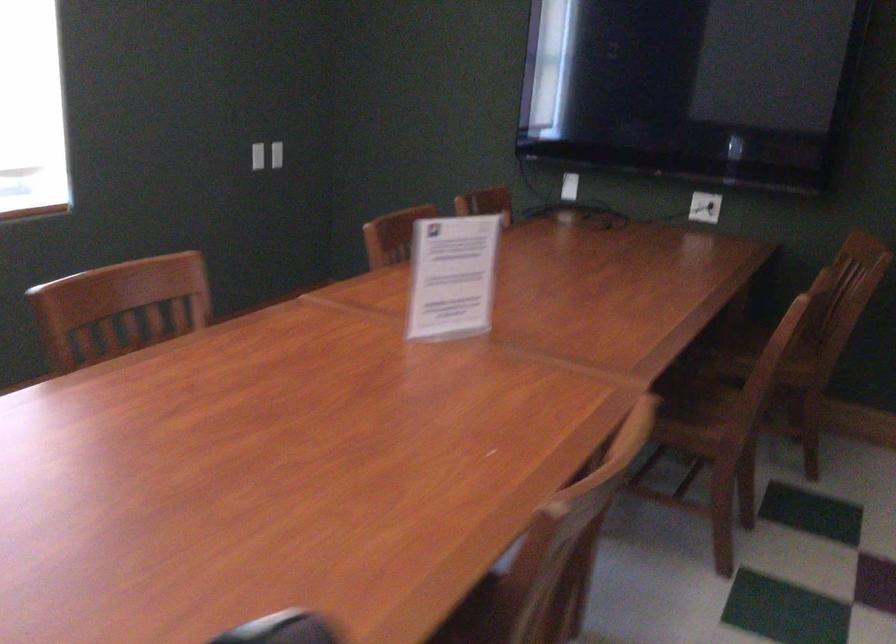
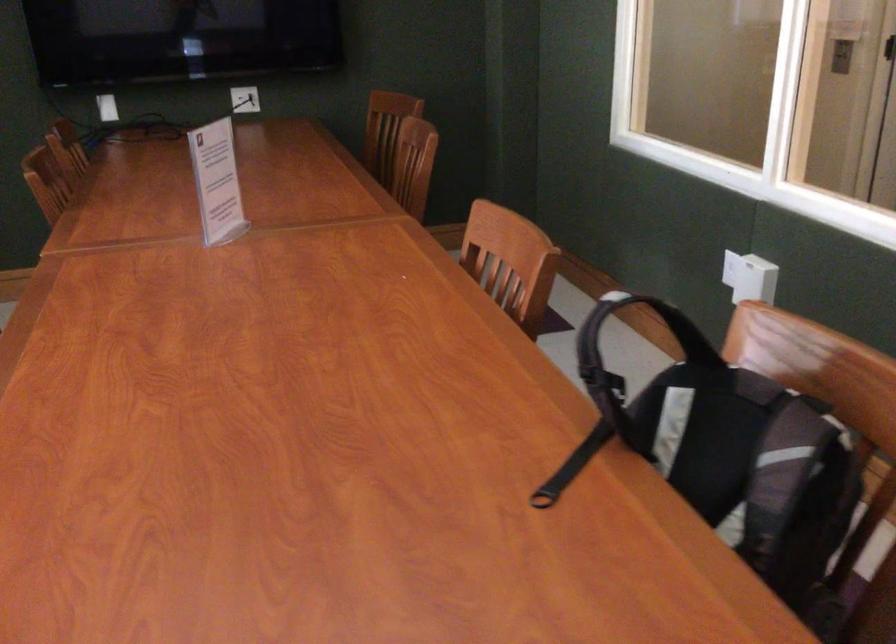
Find the pixel in the second image that matches [590,496] in the first image.

(510, 261)